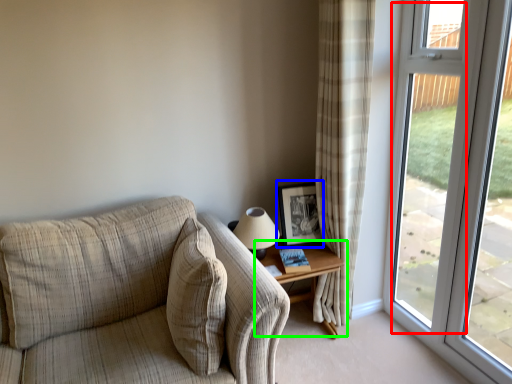
Question: Which object is positioned closest to screen door (highlighted by a red box)? Select from picture frame (highlighted by a blue box) and table (highlighted by a green box).

Choices:
 (A) picture frame
 (B) table

Answer: (A)